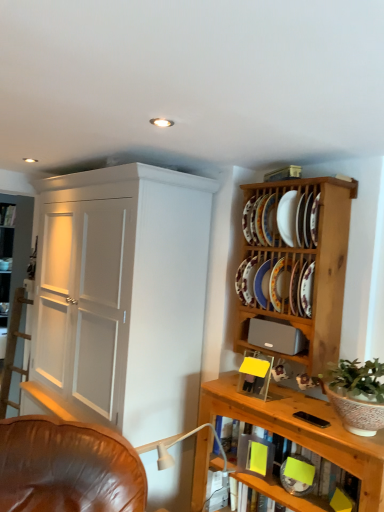
Question: Is porcelain plate at upper right, acting as the 1th platter starting from the bottom, inside the boundaries of white ceramic plate at upper right, or outside?

Choices:
 (A) outside
 (B) inside

Answer: (A)

Question: Looking at their shapes, would you say porcelain plate at upper right, which ranks as the fifth platter in top-to-bottom order, is wider or thinner than white ceramic plate at upper right?

Choices:
 (A) thin
 (B) wide

Answer: (A)

Question: Which object is positioned closest to the white painted wood cupboard at left?

Choices:
 (A) porcelain plate at upper right, acting as the 1th platter starting from the bottom
 (B) wooden shelf at lower right, placed as the second shelf when sorted from top to bottom
 (C) white ceramic plate at upper right
 (D) green leafy plant in textured ceramic pot at right
 (E) gray matte speaker at upper right

Answer: (E)

Question: Which object is the closest to the green leafy plant in textured ceramic pot at right?

Choices:
 (A) white painted wood cupboard at left
 (B) white glossy plate at upper right, which ranks as the second platter in top-to-bottom order
 (C) porcelain plate at upper right, which ranks as the fifth platter in top-to-bottom order
 (D) wooden shelf at lower right, placed as the second shelf when sorted from top to bottom
 (E) porcelain plate at upper right, arranged as the first platter when viewed from the top

Answer: (D)